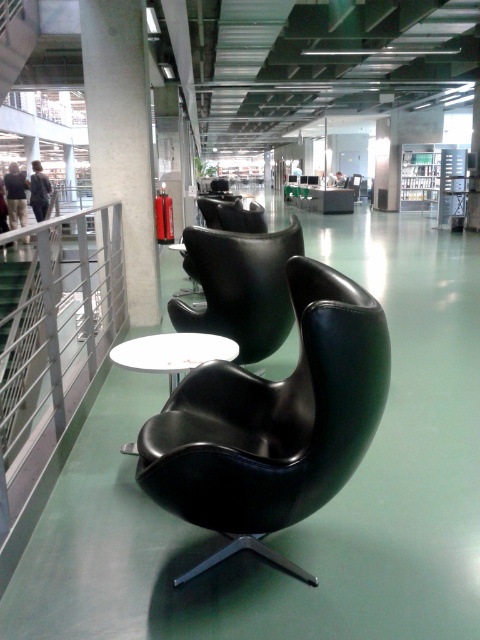
You are a person who is 1.7 meters tall and need to sit down. You see the matte black swivel chair at center and the white glossy round table at center. Which object is higher and would require you to adjust your posture to sit?

The matte black swivel chair at center is taller than the white glossy round table at center, so you would need to adjust your posture to sit on the matte black swivel chair at center.

In the scene shown: You are sitting in the office and want to move from the matte black swivel chair at center to the black leather armchair at center. Which direction should you move to reach it?

The matte black swivel chair at center is below the black leather armchair at center, so you should move upward to reach it.